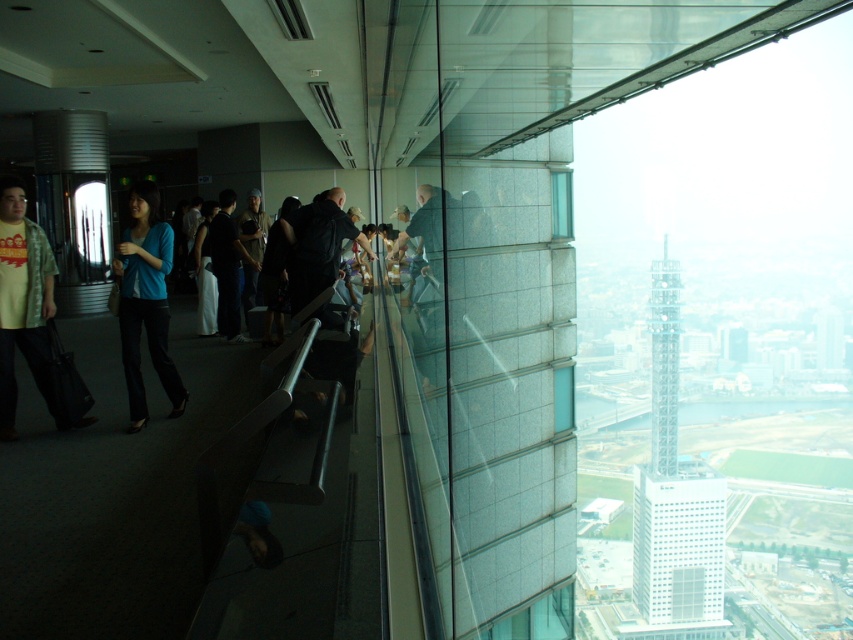
The width and height of the screenshot is (853, 640). Describe the element at coordinates (677, 544) in the screenshot. I see `white glass building at center` at that location.

Looking at this image, who is more distant from viewer, (647, 589) or (42, 305)?

Positioned behind is point (647, 589).

Is point (642, 557) farther from viewer compared to point (15, 209)?

Yes, point (642, 557) is behind point (15, 209).

This screenshot has width=853, height=640. Find the location of `white glass building at center`. white glass building at center is located at coordinates (677, 544).

Which is in front, point (314, 624) or point (643, 513)?

Positioned in front is point (314, 624).

At what (x,y) coordinates should I click in order to perform the action: click on metallic gray escalator at center. Please return your answer as a coordinate pair (x, y). This screenshot has width=853, height=640. Looking at the image, I should click on (289, 513).

Based on the photo, which is more to the right, transparent glass tower at right or dark blue jacket at center?

From the viewer's perspective, transparent glass tower at right appears more on the right side.

Does transparent glass tower at right lie in front of dark blue jacket at center?

That is False.

Measure the distance between point [650,332] and camera.

Point [650,332] and camera are 656.36 meters apart.

I want to click on transparent glass tower at right, so click(664, 362).